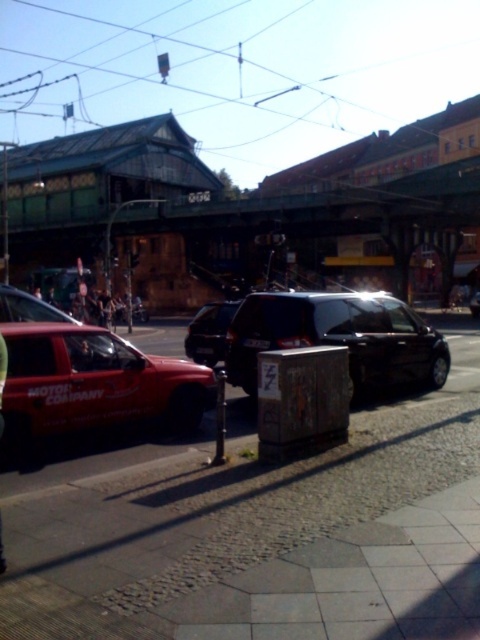
Is point (155, 378) less distant than point (407, 349)?

Yes, it is in front of point (407, 349).

Can you confirm if matte red suv at left is positioned below shiny black van at center?

Yes, matte red suv at left is below shiny black van at center.

The height and width of the screenshot is (640, 480). What do you see at coordinates (93, 381) in the screenshot? I see `matte red suv at left` at bounding box center [93, 381].

Locate an element on the screen. The image size is (480, 640). matte red suv at left is located at coordinates (93, 381).

Is matte red suv at left below brushed metal construction worker at left?

Yes, matte red suv at left is below brushed metal construction worker at left.

Is point (168, 403) farther from viewer compared to point (1, 368)?

Yes, it is.

Which is in front, point (94, 408) or point (0, 552)?

Point (0, 552)

Find the location of `matte red suv at left`. matte red suv at left is located at coordinates (93, 381).

Is cobblestone pavement at center thinner than matte red suv at left?

No, cobblestone pavement at center is not thinner than matte red suv at left.

Does cobblestone pavement at center appear on the right side of matte red suv at left?

Indeed, cobblestone pavement at center is positioned on the right side of matte red suv at left.

Find the location of a particular element. cobblestone pavement at center is located at coordinates (256, 531).